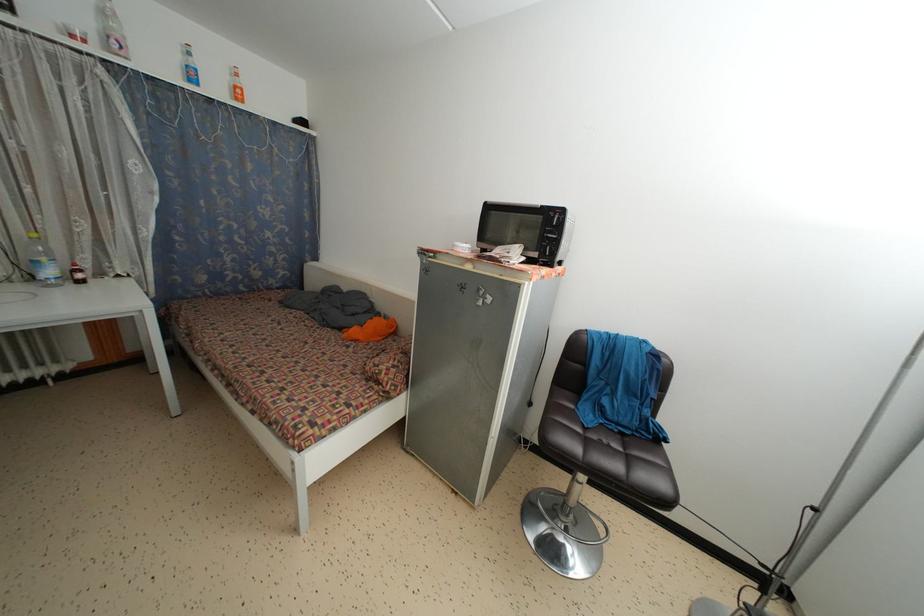
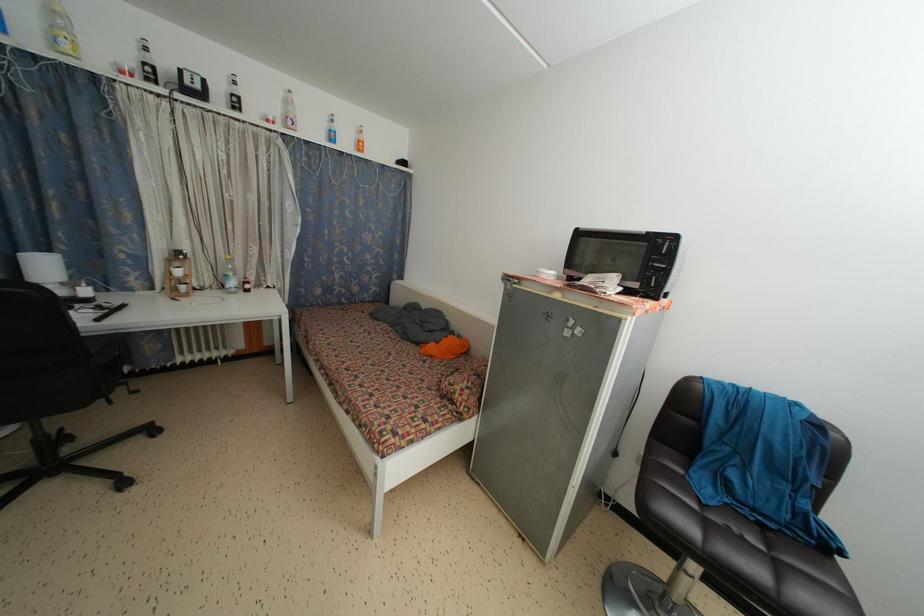
Question: In a continuous first-person perspective shot, in which direction is the camera moving?

Choices:
 (A) Left
 (B) Right
 (C) Forward
 (D) Backward

Answer: (A)